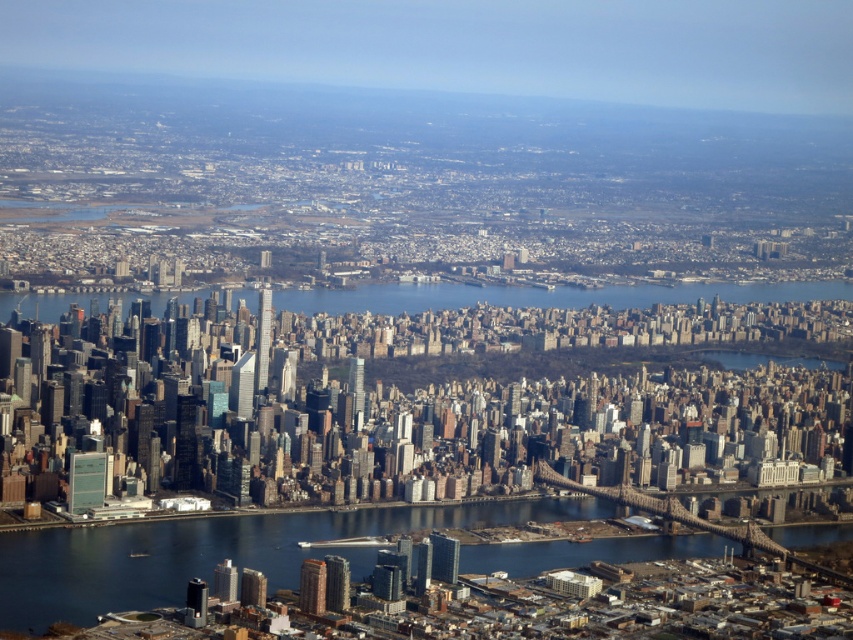
Question: Which point appears farthest from the camera in this image?

Choices:
 (A) (512, 557)
 (B) (16, 300)

Answer: (B)

Question: From the image, what is the correct spatial relationship of blue water at lower center in relation to blue water at center?

Choices:
 (A) below
 (B) above

Answer: (A)

Question: Is blue water at lower center above blue water at center?

Choices:
 (A) yes
 (B) no

Answer: (B)

Question: Does blue water at lower center have a smaller size compared to blue water at center?

Choices:
 (A) yes
 (B) no

Answer: (B)

Question: Which point is farther from the camera taking this photo?

Choices:
 (A) (64, 544)
 (B) (38, 317)

Answer: (A)